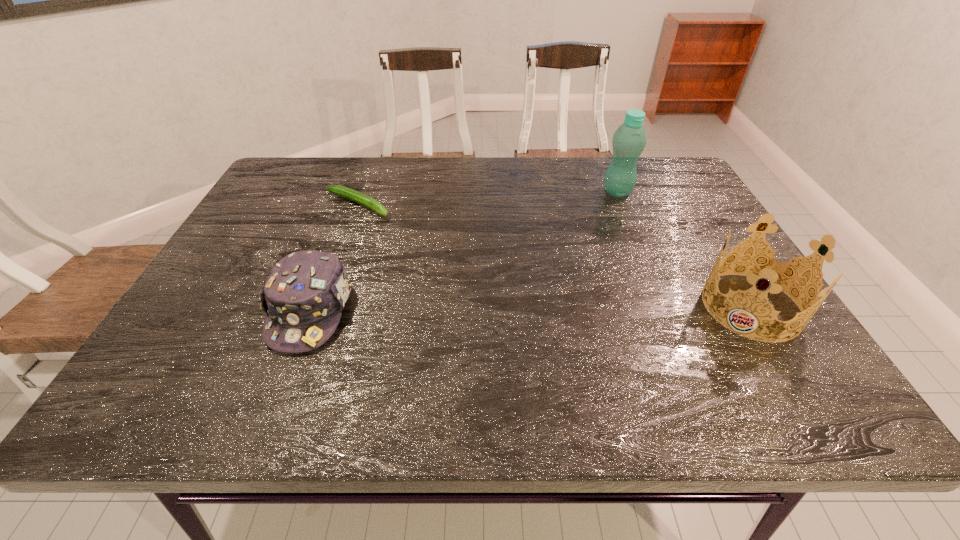
At what (x,y) coordinates should I click in order to perform the action: click on vacant point located between the tallest object and the rightmost object. Please return your answer as a coordinate pair (x, y). The image size is (960, 540). Looking at the image, I should click on (684, 249).

I want to click on free area in between the third object from left to right and the second shortest object, so click(464, 251).

You are a GUI agent. You are given a task and a screenshot of the screen. Output one action in this format:
    pyautogui.click(x=<x>, y=<y>)
    Task: Click on the third closest object to the zucchini
    This screenshot has width=960, height=540.
    Given the screenshot: What is the action you would take?
    pyautogui.click(x=773, y=272)

This screenshot has height=540, width=960. What are the coordinates of `object that is the second nearest to the rightmost object` in the screenshot? It's located at (350, 194).